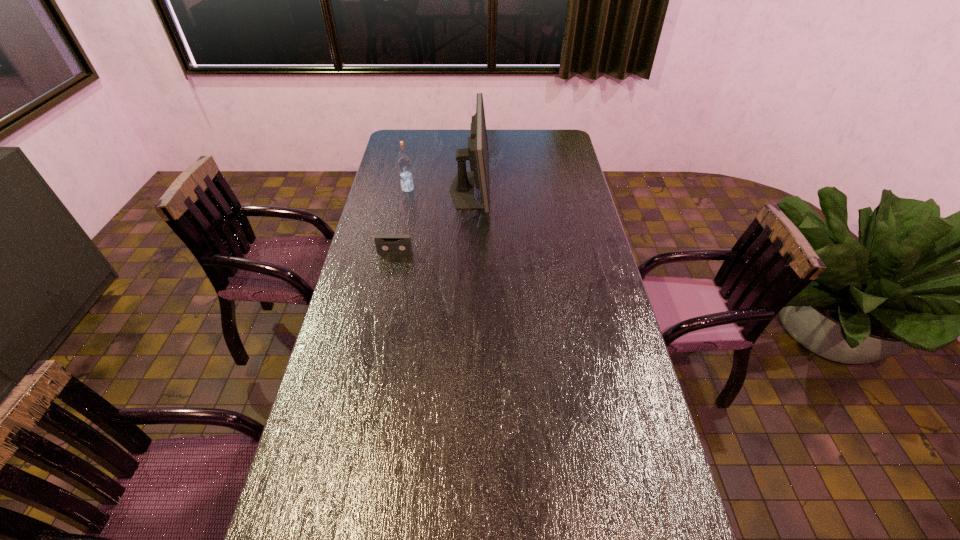
At what (x,y) coordinates should I click in order to perform the action: click on the tallest object. Please return your answer as a coordinate pair (x, y). Looking at the image, I should click on (462, 189).

This screenshot has width=960, height=540. In order to click on computer monitor in this screenshot , I will do `click(462, 189)`.

I want to click on the second shortest object, so click(404, 163).

Where is `the nearest object`? the nearest object is located at coordinates (385, 243).

The height and width of the screenshot is (540, 960). Find the location of `videotape`. videotape is located at coordinates (385, 243).

Locate an element on the screen. Image resolution: width=960 pixels, height=540 pixels. vacant space located on the screen side of the computer monitor is located at coordinates pyautogui.click(x=527, y=190).

In order to click on vacant space situated 0.210m on the right of the second tallest object in this screenshot , I will do `click(463, 189)`.

This screenshot has height=540, width=960. Identify the location of blank space located 0.200m on the front-facing side of the shortest object. (386, 294).

You are a GUI agent. You are given a task and a screenshot of the screen. Output one action in this format:
    pyautogui.click(x=<x>, y=<y>)
    Task: Click on the vodka that is at the left edge
    
    Given the screenshot: What is the action you would take?
    (x=404, y=163)

In order to click on videotape that is at the left edge in this screenshot , I will do `click(385, 243)`.